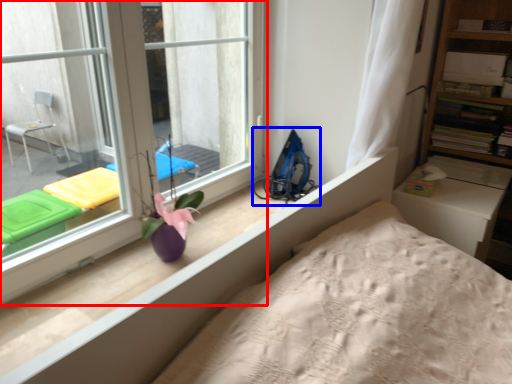
Question: Which of the following is the farthest to the observer, window (highlighted by a red box) or equipment (highlighted by a blue box)?

Choices:
 (A) window
 (B) equipment

Answer: (B)